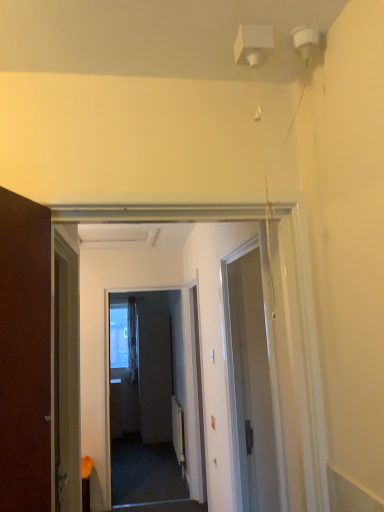
Locate an element on the screen. The width and height of the screenshot is (384, 512). white glossy door at center is located at coordinates (252, 386).

The image size is (384, 512). What are the coordinates of `matte gray screen door at center` in the screenshot? It's located at (154, 374).

Between white sheer curtain at center and white glossy door at center, which one has larger width?

Wider between the two is white sheer curtain at center.

Is white glossy door at center located within white sheer curtain at center?

Definitely not — white glossy door at center is not inside white sheer curtain at center.

Between white sheer curtain at center and white glossy door at center, which one appears on the left side from the viewer's perspective?

Positioned to the left is white sheer curtain at center.

What's the angular difference between white sheer curtain at center and white glossy door at center's facing directions?

white sheer curtain at center and white glossy door at center are facing 88.6 degrees away from each other.

Can you confirm if matte gray screen door at center is positioned to the right of white glossy door at center?

Incorrect, matte gray screen door at center is not on the right side of white glossy door at center.

Which of these two, matte gray screen door at center or white glossy door at center, is wider?

With larger width is matte gray screen door at center.

Where is `door located on the right of matte gray screen door at center`? The width and height of the screenshot is (384, 512). door located on the right of matte gray screen door at center is located at coordinates (252, 386).

Which of these two, matte gray screen door at center or white glossy door at center, stands shorter?

white glossy door at center is shorter.

Where is `curtain on the left of the white glossy door at center`? Image resolution: width=384 pixels, height=512 pixels. curtain on the left of the white glossy door at center is located at coordinates (132, 340).

Is white glossy door at center at the left side of white sheer curtain at center?

No.

From the image's perspective, which one is positioned higher, white glossy door at center or white sheer curtain at center?

white glossy door at center appears higher in the image.

Looking at this image, does matte gray screen door at center have a greater width compared to white sheer curtain at center?

Yes, matte gray screen door at center is wider than white sheer curtain at center.

Between matte gray screen door at center and white sheer curtain at center, which one has less height?

white sheer curtain at center is shorter.

Is matte gray screen door at center in front of or behind white sheer curtain at center in the image?

matte gray screen door at center is in front of white sheer curtain at center.

From a real-world perspective, between white glossy door at center and matte gray screen door at center, who is vertically higher?

white glossy door at center, from a real-world perspective.

How different are the orientations of white glossy door at center and matte gray screen door at center in degrees?

white glossy door at center and matte gray screen door at center are facing 0.743 degrees away from each other.

Can you confirm if white glossy door at center is smaller than matte gray screen door at center?

Yes, white glossy door at center is smaller than matte gray screen door at center.

Consider the image. Considering the sizes of white glossy door at center and matte gray screen door at center in the image, is white glossy door at center taller or shorter than matte gray screen door at center?

Considering their sizes, white glossy door at center has less height than matte gray screen door at center.

From the image's perspective, which object appears higher, white sheer curtain at center or matte gray screen door at center?

white sheer curtain at center.

Considering the relative positions of white sheer curtain at center and matte gray screen door at center in the image provided, is white sheer curtain at center to the right of matte gray screen door at center from the viewer's perspective?

No.

Measure the distance from white sheer curtain at center to matte gray screen door at center.

white sheer curtain at center and matte gray screen door at center are 33.74 centimeters apart.

Considering the sizes of objects white sheer curtain at center and matte gray screen door at center in the image provided, who is shorter, white sheer curtain at center or matte gray screen door at center?

Standing shorter between the two is white sheer curtain at center.

The height and width of the screenshot is (512, 384). Find the location of `door in front of the white sheer curtain at center`. door in front of the white sheer curtain at center is located at coordinates click(x=252, y=386).

Identify the location of screen door on the left of white glossy door at center. (154, 374).

Estimate the real-world distances between objects in this image. Which object is closer to matte gray screen door at center, white glossy door at center or white sheer curtain at center?

white sheer curtain at center is closer to matte gray screen door at center.

Based on their spatial positions, is white sheer curtain at center or white glossy door at center closer to matte gray screen door at center?

Based on the image, white sheer curtain at center appears to be nearer to matte gray screen door at center.

When comparing their distances from white sheer curtain at center, does matte gray screen door at center or white glossy door at center seem closer?

Based on the image, matte gray screen door at center appears to be nearer to white sheer curtain at center.

Considering their positions, is white glossy door at center positioned closer to white sheer curtain at center than matte gray screen door at center?

matte gray screen door at center is closer to white sheer curtain at center.

In the scene shown: From the image, which object appears to be nearer to white glossy door at center, matte gray screen door at center or white sheer curtain at center?

matte gray screen door at center is positioned closer to the anchor white glossy door at center.

Based on their spatial positions, is white sheer curtain at center or matte gray screen door at center further from white glossy door at center?

Based on the image, white sheer curtain at center appears to be further to white glossy door at center.

What are the coordinates of `screen door located between white glossy door at center and white sheer curtain at center in the depth direction` in the screenshot? It's located at (154, 374).